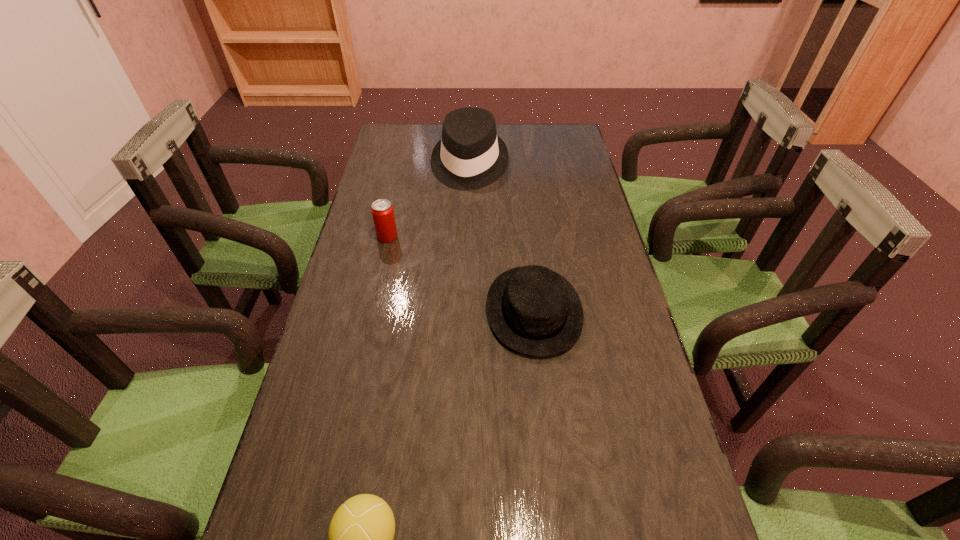
Locate an element on the screen. This screenshot has width=960, height=540. object located at the right edge is located at coordinates (535, 311).

Find the location of a particular element. free spot at the far edge of the desktop is located at coordinates (520, 125).

In the image, there is a desktop. At what (x,y) coordinates should I click in order to perform the action: click on free space at the left edge. Please return your answer as a coordinate pair (x, y). Looking at the image, I should click on (404, 212).

In order to click on vacant region at the right edge of the desktop in this screenshot , I will do `click(615, 336)`.

Image resolution: width=960 pixels, height=540 pixels. In the image, there is a desktop. Find the location of `vacant space at the far right corner`. vacant space at the far right corner is located at coordinates (550, 148).

Identify the location of free spot between the can and the farthest object. This screenshot has width=960, height=540. (428, 201).

Find the location of `vacant space in between the farther fedora and the shorter fedora`. vacant space in between the farther fedora and the shorter fedora is located at coordinates tap(502, 238).

This screenshot has width=960, height=540. Identify the location of free spot between the farther fedora and the third nearest object. (428, 201).

Find the location of a particular element. The image size is (960, 540). free space between the can and the farthest object is located at coordinates (428, 201).

Find the location of `object identified as the closest to the nearest object`. object identified as the closest to the nearest object is located at coordinates (535, 311).